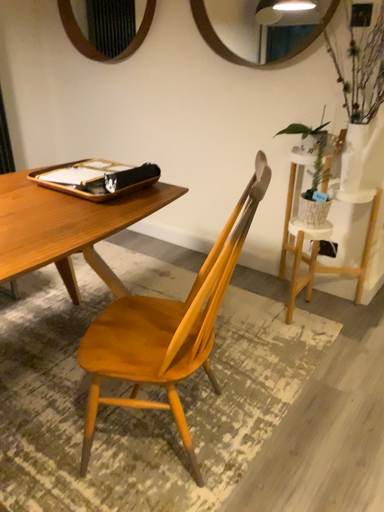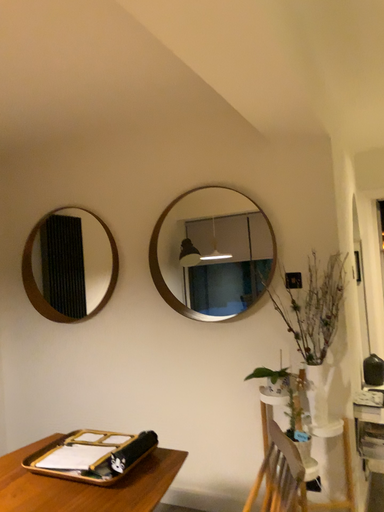
Question: Which way did the camera rotate in the video?

Choices:
 (A) rotated downward
 (B) rotated upward

Answer: (B)